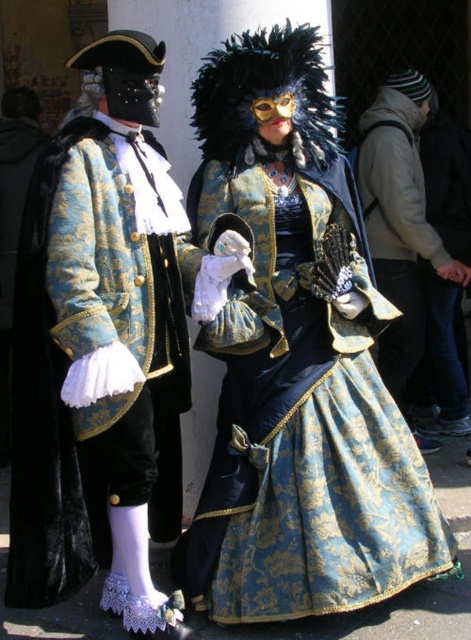
Question: Among these points, which one is nearest to the camera?

Choices:
 (A) (357, 497)
 (B) (390, 257)

Answer: (A)

Question: Is gold brocade dress at center above matte black coat at center?

Choices:
 (A) no
 (B) yes

Answer: (A)

Question: Which object appears closest to the camera in this image?

Choices:
 (A) gold brocade dress at center
 (B) matte black coat at center

Answer: (A)

Question: Is gold brocade dress at center positioned at the back of matte black coat at center?

Choices:
 (A) yes
 (B) no

Answer: (B)

Question: In this image, where is gold brocade dress at center located relative to matte black coat at center?

Choices:
 (A) left
 (B) right

Answer: (A)